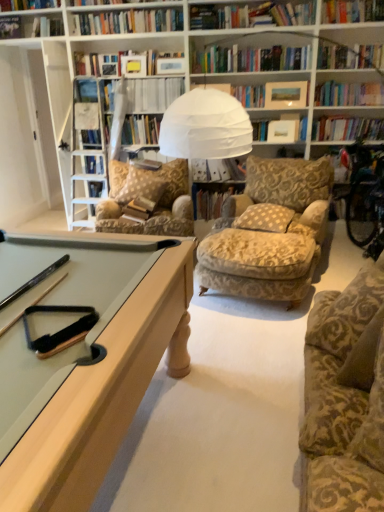
The height and width of the screenshot is (512, 384). What do you see at coordinates (143, 185) in the screenshot? I see `patterned fabric pillow at center, positioned as the 1th pillow in left-to-right order` at bounding box center [143, 185].

How much space does white paper at upper center, arranged as the second book when viewed from the top, occupy horizontally?

The width of white paper at upper center, arranged as the second book when viewed from the top, is 27.32 centimeters.

I want to click on hardcover book at upper center, the first book when ordered from top to bottom, so click(97, 2).

How much space does hardcover book at center, which appears as the fourth book when viewed from the top, occupy vertically?

hardcover book at center, which appears as the fourth book when viewed from the top, is 35.32 centimeters tall.

What do you see at coordinates (265, 218) in the screenshot?
I see `patterned fabric pillow at center, the first pillow from the front` at bounding box center [265, 218].

Describe the element at coordinates (217, 170) in the screenshot. I see `hardcover book at center, which is the second book from bottom to top` at that location.

Locate an element on the screen. This screenshot has height=512, width=384. hardcover book at center, which appears as the third book when viewed from the top is located at coordinates (217, 170).

Locate an element on the screen. This screenshot has width=384, height=512. patterned fabric pillow at center, positioned as the first pillow in back-to-front order is located at coordinates (143, 185).

Is velvet gold couch at right closer to camera compared to gold-patterned fabric chair at center?

Yes.

Considering the sizes of objects velvet gold couch at right and gold-patterned fabric chair at center in the image provided, who is thinner, velvet gold couch at right or gold-patterned fabric chair at center?

gold-patterned fabric chair at center.

How different are the orientations of velvet gold couch at right and gold-patterned fabric chair at center in degrees?

52.4 degrees.

In terms of height, does velvet gold couch at right look taller or shorter compared to gold-patterned fabric chair at center?

Clearly, velvet gold couch at right is shorter compared to gold-patterned fabric chair at center.

Is patterned fabric pillow at center, the 2th pillow from the front, oriented towards velvet gold couch at right?

Yes, patterned fabric pillow at center, the 2th pillow from the front, is turned towards velvet gold couch at right.

Between point (158, 176) and point (365, 425), which one is positioned in front?

Positioned in front is point (365, 425).

There is a velvet gold couch at right. Where is `the 2nd pillow above it (from the image's perspective)`? This screenshot has height=512, width=384. the 2nd pillow above it (from the image's perspective) is located at coordinates (143, 185).

In terms of width, does patterned fabric pillow at center, the second pillow from the right, look wider or thinner when compared to velvet gold couch at right?

patterned fabric pillow at center, the second pillow from the right, is thinner than velvet gold couch at right.

From the image's perspective, does patterned fabric pillow at center, acting as the 1th pillow starting from the right, appear lower than patterned fabric pillow at center, positioned as the first pillow in back-to-front order?

Yes, from the image's perspective, patterned fabric pillow at center, acting as the 1th pillow starting from the right, is below patterned fabric pillow at center, positioned as the first pillow in back-to-front order.

Can you confirm if patterned fabric pillow at center, the first pillow from the front, is smaller than patterned fabric pillow at center, positioned as the 1th pillow in left-to-right order?

Yes, patterned fabric pillow at center, the first pillow from the front, is smaller than patterned fabric pillow at center, positioned as the 1th pillow in left-to-right order.

Is patterned fabric pillow at center, which is the 2th pillow from back to front, shorter than patterned fabric pillow at center, the 2th pillow from the front?

Yes.

From the image's perspective, is hardcover book at center, positioned as the 1th book in bottom-to-top order, under gold-patterned fabric chair at center?

Yes, from the image's perspective, hardcover book at center, positioned as the 1th book in bottom-to-top order, is beneath gold-patterned fabric chair at center.

Is hardcover book at center, positioned as the 1th book in bottom-to-top order, looking in the opposite direction of gold-patterned fabric chair at center?

hardcover book at center, positioned as the 1th book in bottom-to-top order, does not have its back to gold-patterned fabric chair at center.

Considering the relative sizes of hardcover book at center, which appears as the fourth book when viewed from the top, and gold-patterned fabric chair at center in the image provided, is hardcover book at center, which appears as the fourth book when viewed from the top, shorter than gold-patterned fabric chair at center?

Yes.

Is hardcover book at center, positioned as the 1th book in bottom-to-top order, positioned far away from gold-patterned fabric chair at center?

No.

From a real-world perspective, is white paper at upper center, arranged as the second book when viewed from the top, positioned above or below hardcover book at upper center, the first book when ordered from top to bottom?

white paper at upper center, arranged as the second book when viewed from the top, is situated lower than hardcover book at upper center, the first book when ordered from top to bottom, in the real world.

From the image's perspective, relative to hardcover book at upper center, the first book when ordered from top to bottom, is white paper at upper center, arranged as the third book when ordered from the bottom, above or below?

Clearly, from the image's perspective, white paper at upper center, arranged as the third book when ordered from the bottom, is below hardcover book at upper center, the first book when ordered from top to bottom.

Is white paper at upper center, arranged as the third book when ordered from the bottom, oriented towards hardcover book at upper center, which is the 4th book from bottom to top?

No, white paper at upper center, arranged as the third book when ordered from the bottom, is not aimed at hardcover book at upper center, which is the 4th book from bottom to top.

Considering the relative sizes of patterned fabric pillow at center, which is the 2th pillow from back to front, and hardcover book at center, positioned as the 1th book in bottom-to-top order, in the image provided, is patterned fabric pillow at center, which is the 2th pillow from back to front, wider than hardcover book at center, positioned as the 1th book in bottom-to-top order,?

Yes.

Based on the photo, is patterned fabric pillow at center, acting as the 1th pillow starting from the right, aimed at hardcover book at center, positioned as the 1th book in bottom-to-top order?

No, patterned fabric pillow at center, acting as the 1th pillow starting from the right, is not aimed at hardcover book at center, positioned as the 1th book in bottom-to-top order.

Considering the positions of objects patterned fabric pillow at center, acting as the 1th pillow starting from the right, and hardcover book at center, positioned as the 1th book in bottom-to-top order, in the image provided, who is more to the right, patterned fabric pillow at center, acting as the 1th pillow starting from the right, or hardcover book at center, positioned as the 1th book in bottom-to-top order,?

From the viewer's perspective, patterned fabric pillow at center, acting as the 1th pillow starting from the right, appears more on the right side.

Which of these two, patterned fabric pillow at center, arranged as the 2th pillow when viewed from the left, or hardcover book at center, positioned as the 1th book in bottom-to-top order, is smaller?

Smaller between the two is patterned fabric pillow at center, arranged as the 2th pillow when viewed from the left.

Considering the relative sizes of hardcover book at center, which is the second book from bottom to top, and white paper at upper center, arranged as the second book when viewed from the top, in the image provided, is hardcover book at center, which is the second book from bottom to top, taller than white paper at upper center, arranged as the second book when viewed from the top,?

Yes, hardcover book at center, which is the second book from bottom to top, is taller than white paper at upper center, arranged as the second book when viewed from the top.

The image size is (384, 512). Identify the location of the 1st book in front of the hardcover book at center, which appears as the third book when viewed from the top, starting your count from the anchor. (152, 94).

Would you say white paper at upper center, arranged as the second book when viewed from the top, is part of hardcover book at center, which is the second book from bottom to top,'s contents?

No, white paper at upper center, arranged as the second book when viewed from the top, is not surrounded by hardcover book at center, which is the second book from bottom to top.

You are a GUI agent. You are given a task and a screenshot of the screen. Output one action in this format:
    pyautogui.click(x=<x>, y=<y>)
    Task: Click on the studio couch lying in front of the gold-patterned fabric chair at center
    Image resolution: width=384 pixels, height=512 pixels.
    Given the screenshot: What is the action you would take?
    pyautogui.click(x=345, y=397)

Find the location of a particular element. pillow that is the 2nd object located behind the velvet gold couch at right is located at coordinates (143, 185).

From the image, which object appears to be farther from white paper at upper center, arranged as the third book when ordered from the bottom, gold-patterned fabric chair at center or hardcover book at center, which appears as the fourth book when viewed from the top?

The object further to white paper at upper center, arranged as the third book when ordered from the bottom, is hardcover book at center, which appears as the fourth book when viewed from the top.

When comparing their distances from patterned fabric pillow at center, the first pillow from the front, does hardcover book at center, positioned as the 1th book in bottom-to-top order, or gold-patterned fabric chair at center seem further?

gold-patterned fabric chair at center lies further to patterned fabric pillow at center, the first pillow from the front, than the other object.

Considering their positions, is hardcover book at center, positioned as the 1th book in bottom-to-top order, positioned further to patterned fabric pillow at center, arranged as the 2th pillow when viewed from the left, than white paper at upper center, arranged as the third book when ordered from the bottom?

white paper at upper center, arranged as the third book when ordered from the bottom, is further to patterned fabric pillow at center, arranged as the 2th pillow when viewed from the left.

Considering their positions, is patterned fabric pillow at center, the second pillow from the right, positioned further to hardcover book at center, which appears as the third book when viewed from the top, than gold-patterned fabric chair at center?

gold-patterned fabric chair at center is further to hardcover book at center, which appears as the third book when viewed from the top.

Based on their spatial positions, is patterned fabric pillow at center, which is the 2th pillow from back to front, or hardcover book at upper center, the first book when ordered from top to bottom, further from hardcover book at center, positioned as the 1th book in bottom-to-top order?

hardcover book at upper center, the first book when ordered from top to bottom, is further to hardcover book at center, positioned as the 1th book in bottom-to-top order.

In the scene shown: Which object lies nearer to the anchor point hardcover book at upper center, which is the 4th book from bottom to top, hardcover book at center, which is the second book from bottom to top, or velvet gold couch at right?

hardcover book at center, which is the second book from bottom to top.

From the image, which object appears to be farther from patterned fabric pillow at center, positioned as the first pillow in back-to-front order, white paper at upper center, arranged as the third book when ordered from the bottom, or hardcover book at upper center, the first book when ordered from top to bottom?

The object further to patterned fabric pillow at center, positioned as the first pillow in back-to-front order, is hardcover book at upper center, the first book when ordered from top to bottom.

Which object lies nearer to the anchor point white paper at upper center, arranged as the second book when viewed from the top, velvet gold couch at right or patterned fabric pillow at center, the first pillow from the front?

The object closer to white paper at upper center, arranged as the second book when viewed from the top, is patterned fabric pillow at center, the first pillow from the front.

Locate an element on the screen. chair that lies between white paper at upper center, arranged as the second book when viewed from the top, and hardcover book at center, which appears as the fourth book when viewed from the top, from top to bottom is located at coordinates (148, 197).

Identify the location of pillow between patterned fabric pillow at center, the first pillow from the front, and hardcover book at center, which is the second book from bottom to top, in the front-back direction. This screenshot has width=384, height=512. (143, 185).

Image resolution: width=384 pixels, height=512 pixels. I want to click on book positioned between velvet gold couch at right and white paper at upper center, arranged as the second book when viewed from the top, from near to far, so click(97, 2).

You are a GUI agent. You are given a task and a screenshot of the screen. Output one action in this format:
    pyautogui.click(x=<x>, y=<y>)
    Task: Click on the pillow between white paper at upper center, arranged as the third book when ordered from the bottom, and patterned fabric pillow at center, arranged as the 2th pillow when viewed from the left, in the up-down direction
    
    Given the screenshot: What is the action you would take?
    pyautogui.click(x=143, y=185)